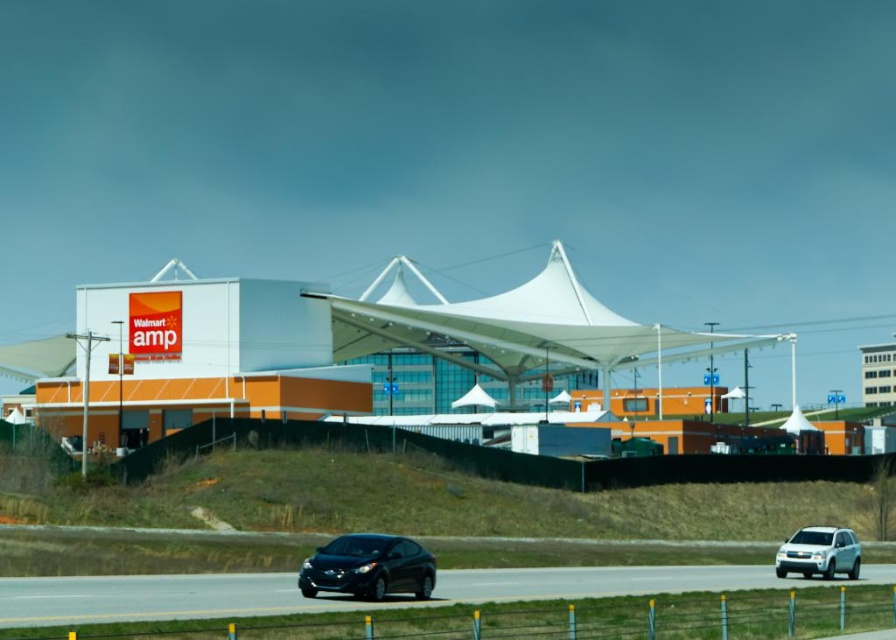
Question: Is black asphalt highway at lower center behind glossy black car at lower center?

Choices:
 (A) no
 (B) yes

Answer: (A)

Question: Which point is closer to the camera taking this photo?

Choices:
 (A) (872, 576)
 (B) (401, 577)

Answer: (B)

Question: Is black asphalt highway at lower center positioned at the back of white matte suv at lower right?

Choices:
 (A) yes
 (B) no

Answer: (B)

Question: Does glossy black car at lower center appear on the right side of white matte suv at lower right?

Choices:
 (A) no
 (B) yes

Answer: (A)

Question: Which object is closer to the camera taking this photo?

Choices:
 (A) glossy black car at lower center
 (B) white matte suv at lower right

Answer: (A)

Question: Which point is farther from the camera taking this photo?

Choices:
 (A) (831, 538)
 (B) (570, 573)
 (C) (388, 572)

Answer: (B)